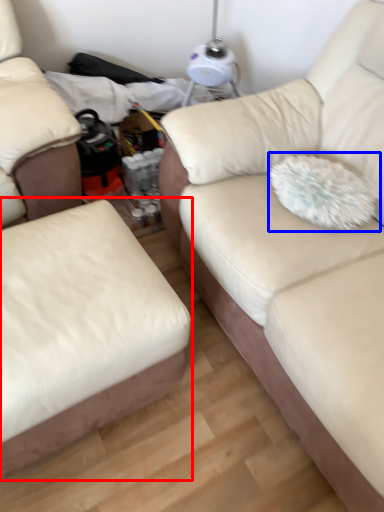
Question: Which point is further to the camera, studio couch (highlighted by a red box) or throw pillow (highlighted by a blue box)?

Choices:
 (A) studio couch
 (B) throw pillow

Answer: (B)